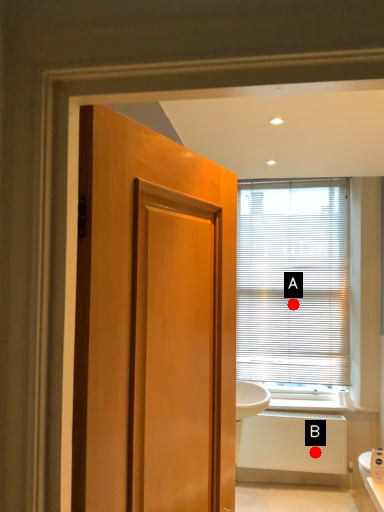
Question: Two points are circled on the image, labeled by A and B beside each circle. Which point is farther from the camera taking this photo?

Choices:
 (A) A is further
 (B) B is further

Answer: (A)